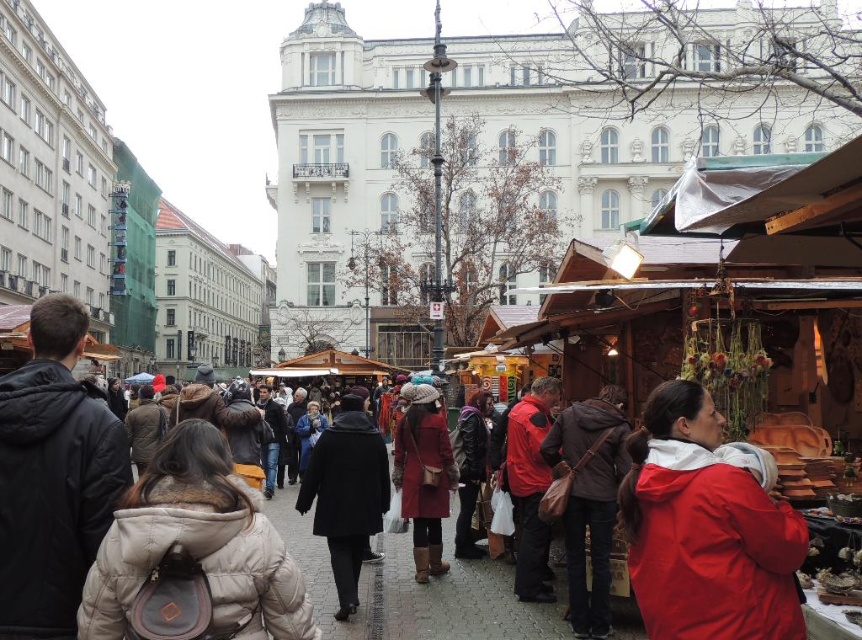
Question: Does red matte jacket at lower right have a larger size compared to dark gray jacket at left?

Choices:
 (A) yes
 (B) no

Answer: (B)

Question: Does puffy beige coat at center have a lesser width compared to matte brown coat at center?

Choices:
 (A) no
 (B) yes

Answer: (A)

Question: Which point is farther to the camera?

Choices:
 (A) dark gray jacket at left
 (B) red matte jacket at center
 (C) red matte jacket at lower right

Answer: (B)

Question: Does brown leather jacket at center have a lesser width compared to red matte jacket at center?

Choices:
 (A) no
 (B) yes

Answer: (A)

Question: Which of these objects is positioned farthest from the matte black coat at center?

Choices:
 (A) puffy beige coat at center
 (B) matte brown coat at center

Answer: (A)

Question: Which of these objects is positioned closest to the brown leather jacket at center?

Choices:
 (A) red matte jacket at center
 (B) dark gray jacket at left
 (C) matte brown coat at center
 (D) red matte jacket at lower right

Answer: (A)